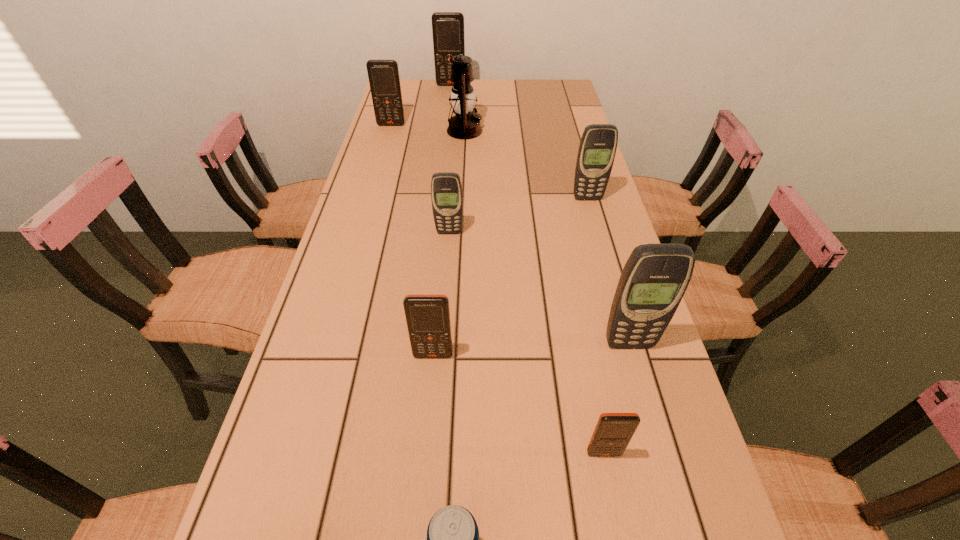
This screenshot has width=960, height=540. What are the coordinates of `lantern` in the screenshot? It's located at (465, 124).

What are the coordinates of `the farthest object` in the screenshot? It's located at (447, 27).

The image size is (960, 540). In order to click on the farthest orange cellular telephone in this screenshot , I will do `click(447, 27)`.

Image resolution: width=960 pixels, height=540 pixels. I want to click on the biggest gray cellular telephone, so click(655, 277).

Find the location of a particular element. Image resolution: width=960 pixels, height=540 pixels. the third nearest cellular telephone is located at coordinates (655, 277).

Identify the location of the third nearest orange cellular telephone. The height and width of the screenshot is (540, 960). (383, 75).

Locate an element on the screen. The width and height of the screenshot is (960, 540). the leftmost cellular telephone is located at coordinates (383, 75).

Where is `the farthest gray cellular telephone`? Image resolution: width=960 pixels, height=540 pixels. the farthest gray cellular telephone is located at coordinates (598, 145).

The width and height of the screenshot is (960, 540). I want to click on the second biggest gray cellular telephone, so click(598, 145).

In order to click on the fourth farthest cellular telephone in this screenshot , I will do `click(446, 189)`.